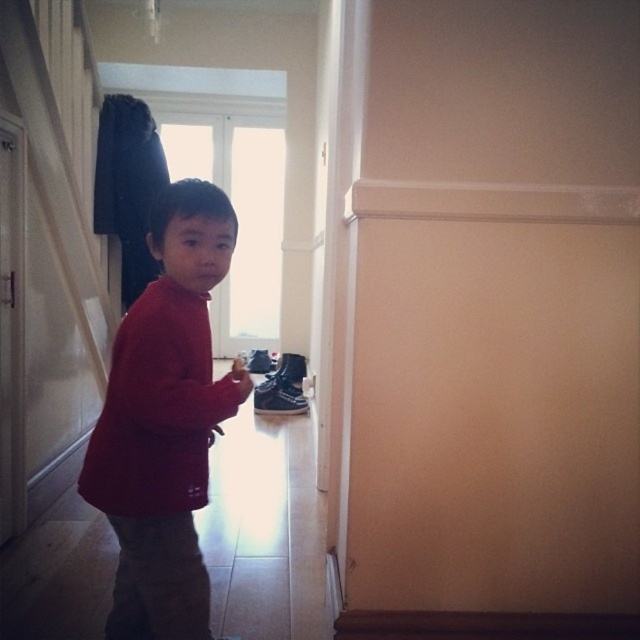
Question: Which point is farther to the camera?

Choices:
 (A) black suede shoe at lower center
 (B) red matte sweater at center

Answer: (A)

Question: From the image, what is the correct spatial relationship of red matte sweater at center in relation to black suede shoe at lower center?

Choices:
 (A) right
 (B) left

Answer: (B)

Question: Does red matte sweater at center appear on the right side of black suede shoe at lower center?

Choices:
 (A) no
 (B) yes

Answer: (A)

Question: Which of the following is the farthest from the observer?

Choices:
 (A) (262, 397)
 (B) (97, 420)

Answer: (A)

Question: Considering the relative positions of red matte sweater at center and black suede shoe at lower center in the image provided, where is red matte sweater at center located with respect to black suede shoe at lower center?

Choices:
 (A) above
 (B) below

Answer: (A)